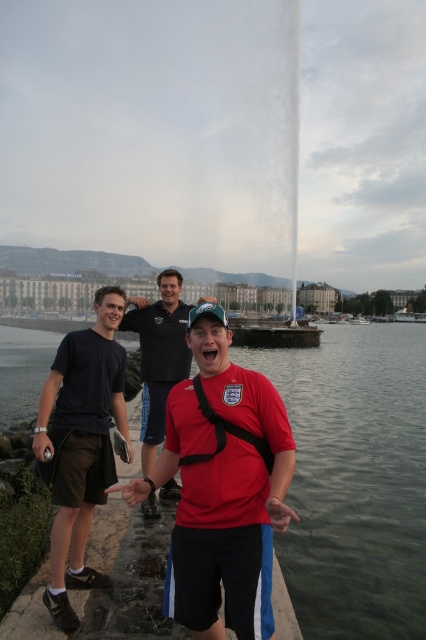
You are taking a photo of two people wearing matte red shirt at center and matte black shirt at center. Which one appears smaller in the photo?

The matte red shirt at center appears smaller than the matte black shirt at center in the photo.

You are taking a photo of the waterfront scene. You want to focus on the point closer to the camera between the two points, point (201,356) and point (65,596). Which point should you focus on?

You should focus on point (201,356) because it is further to the camera than point (65,596).